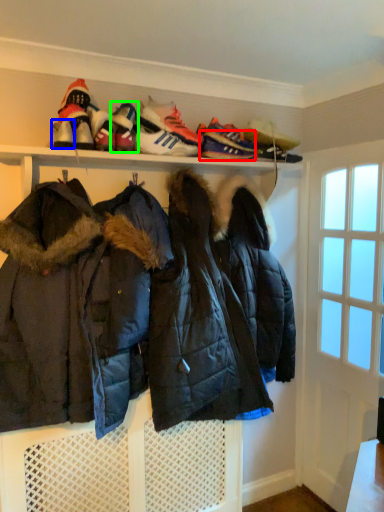
Question: Estimate the real-world distances between objects in this image. Which object is farther from shoe (highlighted by a red box), shoe (highlighted by a blue box) or footwear (highlighted by a green box)?

Choices:
 (A) shoe
 (B) footwear

Answer: (A)